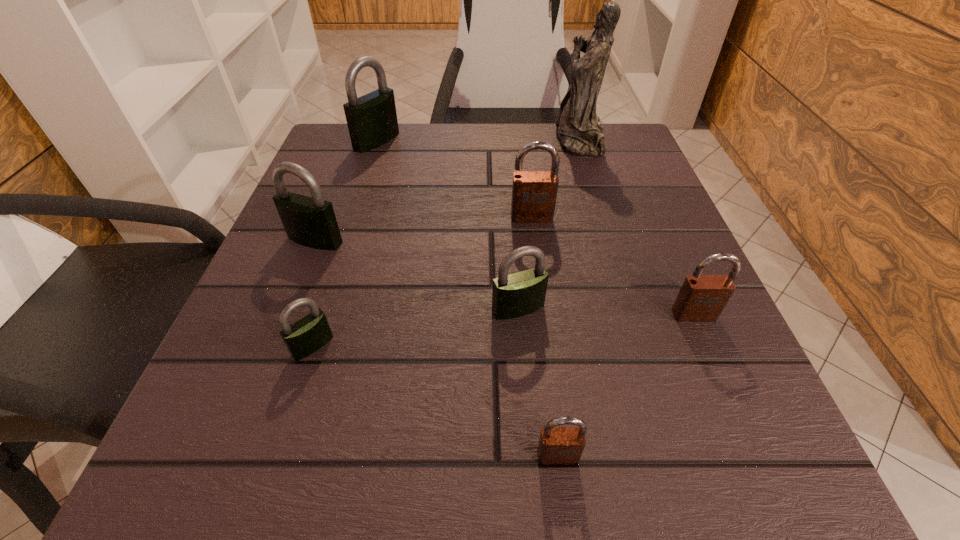
Select which object is the fourth closest to the biggest brown padlock. Please provide its 2D coordinates. Your answer should be formatted as a tuple, i.e. [(x, y)], where the tuple contains the x and y coordinates of a point satisfying the conditions above.

[(310, 221)]

This screenshot has width=960, height=540. In order to click on the second closest padlock relative to the fourth farthest object in this screenshot , I will do `click(372, 121)`.

Find the location of a particular element. padlock object that ranks as the sixth closest to the nearest object is located at coordinates (372, 121).

Identify the location of black padlock that can be found as the fourth closest to the rightmost brown padlock. This screenshot has width=960, height=540. (372, 121).

Where is `black padlock that is the second closest to the fourth farthest object`? black padlock that is the second closest to the fourth farthest object is located at coordinates (372, 121).

Find the location of a particular element. Image resolution: width=960 pixels, height=540 pixels. brown padlock that stands as the second closest to the rightmost object is located at coordinates (557, 445).

Find the location of a particular element. This screenshot has height=540, width=960. brown padlock that is the closest to the fifth nearest padlock is located at coordinates (534, 193).

Where is `vacant point that satisfies the following two spatial constraints: 1. on the front-facing side of the figurine; 2. on the front-facing side of the farthest brown padlock`? This screenshot has width=960, height=540. vacant point that satisfies the following two spatial constraints: 1. on the front-facing side of the figurine; 2. on the front-facing side of the farthest brown padlock is located at coordinates (603, 217).